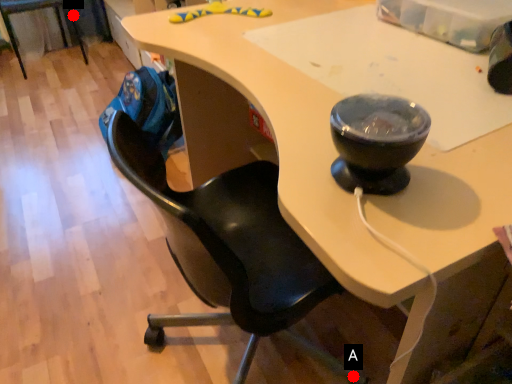
Question: Two points are circled on the image, labeled by A and B beside each circle. Which point is closer to the camera?

Choices:
 (A) A is closer
 (B) B is closer

Answer: (A)